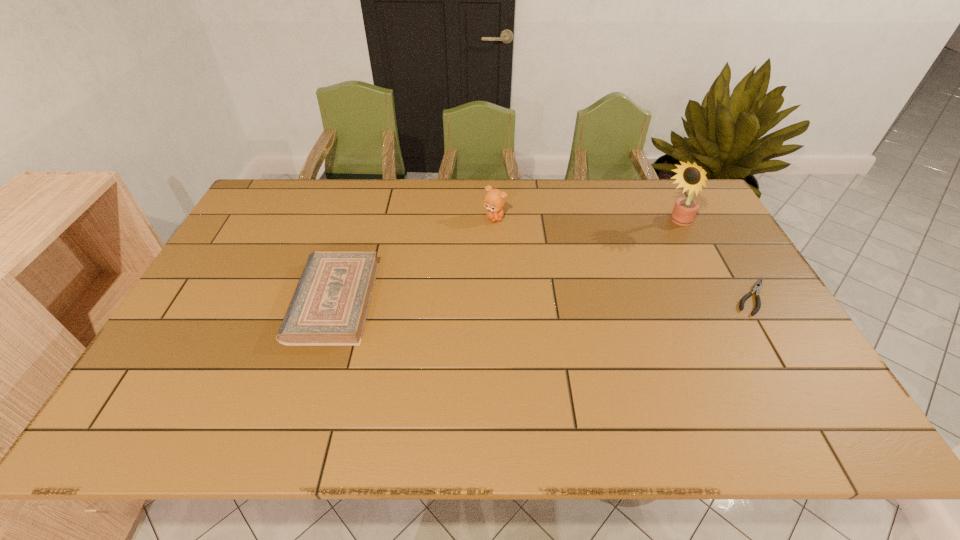
This screenshot has width=960, height=540. Identify the location of free space between the shortest object and the third object from right to left. (623, 257).

Where is `free spot between the second tallest object and the sunflower`? This screenshot has height=540, width=960. free spot between the second tallest object and the sunflower is located at coordinates (586, 221).

Where is `vacant region between the pliers and the leftmost object`? The image size is (960, 540). vacant region between the pliers and the leftmost object is located at coordinates (543, 299).

You are a GUI agent. You are given a task and a screenshot of the screen. Output one action in this format:
    pyautogui.click(x=<x>, y=<y>)
    Task: Click on the unoccupied area between the pliers and the second shortest object
    
    Given the screenshot: What is the action you would take?
    pyautogui.click(x=543, y=299)

Where is `blank region between the teddy bear and the shortest object`? The image size is (960, 540). blank region between the teddy bear and the shortest object is located at coordinates (623, 257).

Find the location of a particular element. The image size is (960, 540). vacant space that's between the sunflower and the second shortest object is located at coordinates (505, 262).

Locate an element on the screen. The width and height of the screenshot is (960, 540). vacant space that's between the shortest object and the leftmost object is located at coordinates click(543, 299).

The height and width of the screenshot is (540, 960). Identify the location of free space between the leftmost object and the shortest object. (543, 299).

Point out which object is positioned as the third nearest to the sunflower. Please provide its 2D coordinates. Your answer should be formatted as a tuple, i.e. [(x, y)], where the tuple contains the x and y coordinates of a point satisfying the conditions above.

[(330, 304)]

At what (x,y) coordinates should I click in order to perform the action: click on the third closest object to the third object from right to left. Please return your answer as a coordinate pair (x, y). Looking at the image, I should click on (757, 286).